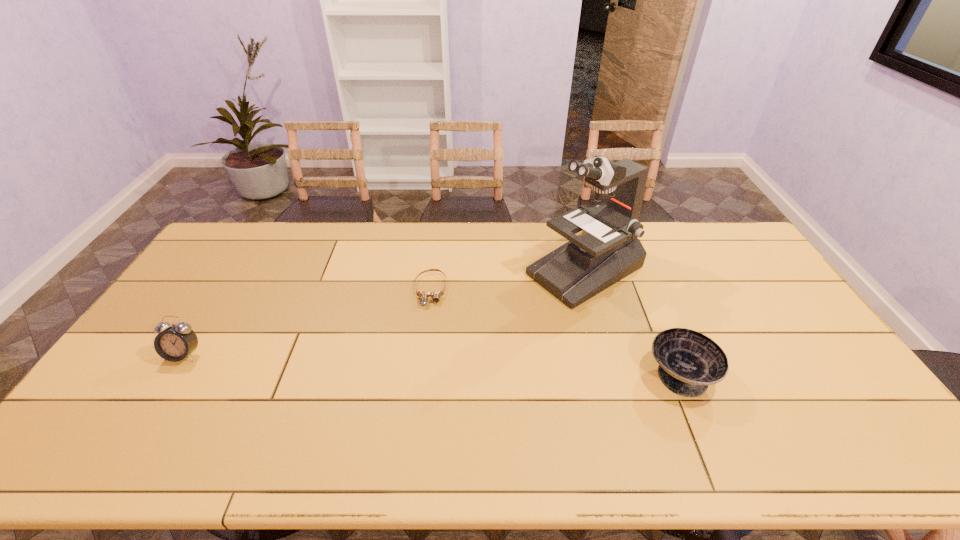
Identify the location of blank space at the right edge of the desktop. The height and width of the screenshot is (540, 960). (754, 262).

Locate an element on the screen. This screenshot has width=960, height=540. vacant space at the far left corner is located at coordinates (260, 233).

The width and height of the screenshot is (960, 540). Find the location of `free point between the third tallest object and the alarm clock`. free point between the third tallest object and the alarm clock is located at coordinates (432, 364).

At what (x,y) coordinates should I click in order to perform the action: click on free space that is in between the tallest object and the third object from right to left. Please return your answer as a coordinate pair (x, y). Looking at the image, I should click on (508, 280).

Locate an element on the screen. The width and height of the screenshot is (960, 540). vacant area that lies between the tallest object and the goggles is located at coordinates (508, 280).

Where is `free area in between the goggles and the third shortest object`? The height and width of the screenshot is (540, 960). free area in between the goggles and the third shortest object is located at coordinates (307, 322).

Find the location of a particular element. The width and height of the screenshot is (960, 540). empty space between the microscope and the shortest object is located at coordinates (508, 280).

Identify the location of vacant region between the leftmost object and the tallest object. The height and width of the screenshot is (540, 960). (384, 313).

At what (x,y) coordinates should I click in order to perform the action: click on free spot between the bowl and the third object from right to left. Please return your answer as a coordinate pair (x, y). This screenshot has width=960, height=540. Looking at the image, I should click on (556, 332).

This screenshot has width=960, height=540. I want to click on empty space between the alarm clock and the third tallest object, so click(x=432, y=364).